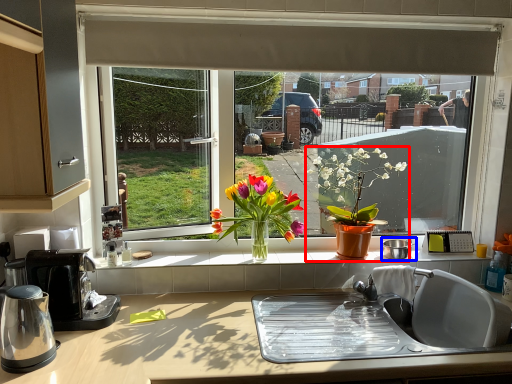
Question: Which point is further to the camera, houseplant (highlighted by a red box) or appliance (highlighted by a blue box)?

Choices:
 (A) houseplant
 (B) appliance

Answer: (B)